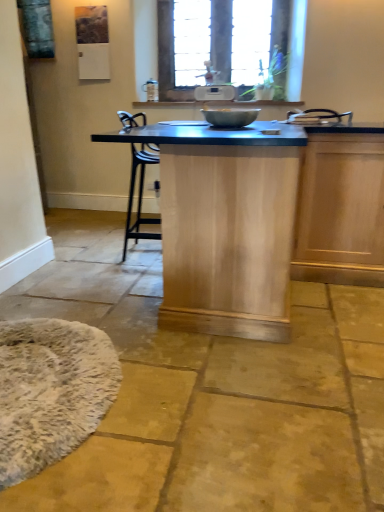
This screenshot has width=384, height=512. Find the location of `white fluffy mat at lower left`. white fluffy mat at lower left is located at coordinates (51, 391).

The height and width of the screenshot is (512, 384). What do you see at coordinates (262, 218) in the screenshot?
I see `natural wood table at center` at bounding box center [262, 218].

Identify the location of wooden frame at upper center. pos(170,57).

Considering the relative sizes of natural wood table at center and wooden frame at upper center in the image provided, is natural wood table at center smaller than wooden frame at upper center?

No.

Considering the relative sizes of natural wood table at center and wooden frame at upper center in the image provided, is natural wood table at center thinner than wooden frame at upper center?

No.

Which is in front, natural wood table at center or wooden frame at upper center?

natural wood table at center is closer to the camera.

From a real-world perspective, is white fluffy mat at lower left below wooden frame at upper center?

Yes, from a real-world perspective, white fluffy mat at lower left is below wooden frame at upper center.

Considering the relative sizes of white fluffy mat at lower left and wooden frame at upper center in the image provided, is white fluffy mat at lower left shorter than wooden frame at upper center?

Correct, white fluffy mat at lower left is not as tall as wooden frame at upper center.

Would you consider white fluffy mat at lower left to be distant from wooden frame at upper center?

That's right, there is a large distance between white fluffy mat at lower left and wooden frame at upper center.

From the image's perspective, would you say white fluffy mat at lower left is shown under wooden frame at upper center?

Yes.

Based on the photo, which point is more distant from viewer, (x=285, y=49) or (x=92, y=423)?

The point (x=285, y=49) is farther from the camera.

From the image's perspective, which is above, wooden frame at upper center or white fluffy mat at lower left?

wooden frame at upper center is shown above in the image.

Is white fluffy mat at lower left at the back of wooden frame at upper center?

wooden frame at upper center does not have its back to white fluffy mat at lower left.

Considering the sizes of objects wooden frame at upper center and white fluffy mat at lower left in the image provided, who is thinner, wooden frame at upper center or white fluffy mat at lower left?

Thinner between the two is wooden frame at upper center.

Is wooden frame at upper center oriented away from natural wood table at center?

No, natural wood table at center is not at the back of wooden frame at upper center.

Is wooden frame at upper center far from natural wood table at center?

wooden frame at upper center is positioned a significant distance from natural wood table at center.

Is point (195, 79) closer or farther from the camera than point (197, 187)?

Point (195, 79) appears to be farther away from the viewer than point (197, 187).

Which of these two, wooden frame at upper center or natural wood table at center, is thinner?

Thinner between the two is wooden frame at upper center.

Does metallic silver mixing bowl at center have a greater width compared to natural wood table at center?

In fact, metallic silver mixing bowl at center might be narrower than natural wood table at center.

Is metallic silver mixing bowl at center looking in the opposite direction of natural wood table at center?

Result: No.

How many degrees apart are the facing directions of metallic silver mixing bowl at center and natural wood table at center?

The angle between the facing direction of metallic silver mixing bowl at center and the facing direction of natural wood table at center is 0.463 degrees.

Does metallic silver mixing bowl at center appear on the left side of natural wood table at center?

In fact, metallic silver mixing bowl at center is to the right of natural wood table at center.

Considering the sizes of objects natural wood table at center and white fluffy mat at lower left in the image provided, who is wider, natural wood table at center or white fluffy mat at lower left?

With larger width is natural wood table at center.

Does point (271, 246) lie in front of point (75, 375)?

No, it is behind (75, 375).

From the image's perspective, is natural wood table at center beneath white fluffy mat at lower left?

No, from the image's perspective, natural wood table at center is not below white fluffy mat at lower left.

Does natural wood table at center turn towards white fluffy mat at lower left?

No, natural wood table at center is not turned towards white fluffy mat at lower left.

In terms of height, does white fluffy mat at lower left look taller or shorter compared to metallic silver mixing bowl at center?

Clearly, white fluffy mat at lower left is taller compared to metallic silver mixing bowl at center.

Does point (21, 459) lie in front of point (221, 117)?

That is True.

Can you confirm if white fluffy mat at lower left is smaller than metallic silver mixing bowl at center?

Answer: No.

The width and height of the screenshot is (384, 512). In order to click on mat that is on the left side of metallic silver mixing bowl at center in this screenshot , I will do `click(51, 391)`.

You are a GUI agent. You are given a task and a screenshot of the screen. Output one action in this format:
    pyautogui.click(x=<x>, y=<y>)
    Task: Click on the window located above the natural wood table at center (from the image's perspective)
    The width and height of the screenshot is (384, 512).
    Given the screenshot: What is the action you would take?
    pyautogui.click(x=170, y=57)

This screenshot has height=512, width=384. What are the coordinates of `window on the right of white fluffy mat at lower left` in the screenshot? It's located at (170, 57).

Estimate the real-world distances between objects in this image. Which object is closer to wooden frame at upper center, white fluffy mat at lower left or metallic silver mixing bowl at center?

Based on the image, metallic silver mixing bowl at center appears to be nearer to wooden frame at upper center.

Estimate the real-world distances between objects in this image. Which object is closer to wooden frame at upper center, white fluffy mat at lower left or natural wood table at center?

natural wood table at center.

When comparing their distances from metallic silver mixing bowl at center, does wooden frame at upper center or natural wood table at center seem further?

Based on the image, wooden frame at upper center appears to be further to metallic silver mixing bowl at center.

When comparing their distances from white fluffy mat at lower left, does natural wood table at center or metallic silver mixing bowl at center seem further?

metallic silver mixing bowl at center is further to white fluffy mat at lower left.

Considering their positions, is white fluffy mat at lower left positioned closer to natural wood table at center than wooden frame at upper center?

white fluffy mat at lower left lies closer to natural wood table at center than the other object.

From the image, which object appears to be nearer to natural wood table at center, wooden frame at upper center or metallic silver mixing bowl at center?

metallic silver mixing bowl at center lies closer to natural wood table at center than the other object.

From the image, which object appears to be nearer to metallic silver mixing bowl at center, white fluffy mat at lower left or wooden frame at upper center?

white fluffy mat at lower left.

Looking at the image, which one is located closer to wooden frame at upper center, natural wood table at center or white fluffy mat at lower left?

natural wood table at center is positioned closer to the anchor wooden frame at upper center.

The height and width of the screenshot is (512, 384). What are the coordinates of `mixing bowl between natural wood table at center and wooden frame at upper center from front to back` in the screenshot? It's located at (230, 117).

The image size is (384, 512). Find the location of `table located between white fluffy mat at lower left and wooden frame at upper center in the depth direction`. table located between white fluffy mat at lower left and wooden frame at upper center in the depth direction is located at coordinates (262, 218).

Where is `mixing bowl between white fluffy mat at lower left and wooden frame at upper center along the z-axis`? mixing bowl between white fluffy mat at lower left and wooden frame at upper center along the z-axis is located at coordinates (230, 117).

The width and height of the screenshot is (384, 512). Identify the location of table between metallic silver mixing bowl at center and white fluffy mat at lower left vertically. (262, 218).